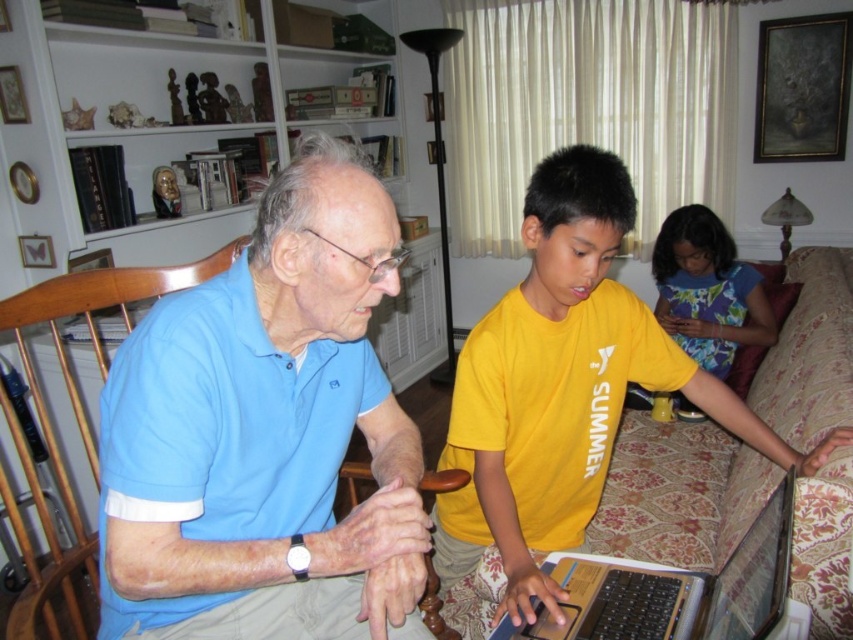
Between yellow cotton shirt at center and white plastic laptop at lower center, which one is positioned higher?

yellow cotton shirt at center is higher up.

Is point (764, 442) positioned in front of point (558, 625)?

No, (764, 442) is further to viewer.

Between point (473, 528) and point (621, 628), which one is positioned behind?

Point (473, 528)

Locate an element on the screen. The height and width of the screenshot is (640, 853). yellow cotton shirt at center is located at coordinates (564, 387).

Between light blue cotton shirt at left and white plastic laptop at lower center, which one has more height?

light blue cotton shirt at left

Measure the distance between point (x=241, y=563) and camera.

Point (x=241, y=563) and camera are 87.62 centimeters apart.

In order to click on light blue cotton shirt at left in this screenshot , I will do `click(265, 435)`.

Between light blue cotton shirt at left and yellow cotton shirt at center, which one appears on the right side from the viewer's perspective?

yellow cotton shirt at center

The width and height of the screenshot is (853, 640). What do you see at coordinates (265, 435) in the screenshot? I see `light blue cotton shirt at left` at bounding box center [265, 435].

What are the coordinates of `light blue cotton shirt at left` in the screenshot? It's located at (265, 435).